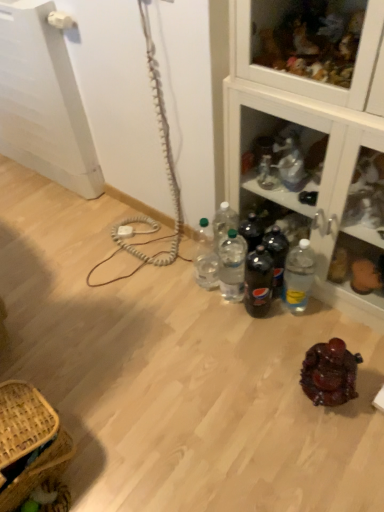
Question: Considering the relative sizes of dark glass bottle at center, the 3th bottle positioned from the right, and brown woven picnic basket at lower left in the image provided, is dark glass bottle at center, the 3th bottle positioned from the right, bigger than brown woven picnic basket at lower left?

Choices:
 (A) no
 (B) yes

Answer: (A)

Question: Is dark glass bottle at center, the 3th bottle positioned from the right, to the left of brown woven picnic basket at lower left from the viewer's perspective?

Choices:
 (A) yes
 (B) no

Answer: (B)

Question: Does dark glass bottle at center, the third bottle viewed from the left, have a lesser height compared to brown woven picnic basket at lower left?

Choices:
 (A) no
 (B) yes

Answer: (A)

Question: Is dark glass bottle at center, the third bottle viewed from the left, far from brown woven picnic basket at lower left?

Choices:
 (A) no
 (B) yes

Answer: (A)

Question: Is dark glass bottle at center, the third bottle viewed from the left, positioned beyond the bounds of brown woven picnic basket at lower left?

Choices:
 (A) yes
 (B) no

Answer: (A)

Question: In terms of height, does clear plastic bottles at center, the fifth bottle positioned from the right, look taller or shorter compared to clear plastic bottle at lower right, which is counted as the fifth bottle, starting from the left?

Choices:
 (A) tall
 (B) short

Answer: (A)

Question: Considering their positions, is clear plastic bottles at center, the fifth bottle positioned from the right, located in front of or behind clear plastic bottle at lower right, which is counted as the fifth bottle, starting from the left?

Choices:
 (A) behind
 (B) front

Answer: (A)

Question: From a real-world perspective, relative to clear plastic bottle at lower right, which appears as the 1th bottle when viewed from the right, is clear plastic bottles at center, the first bottle in the left-to-right sequence, vertically above or below?

Choices:
 (A) above
 (B) below

Answer: (A)

Question: Does point (203, 274) appear closer or farther from the camera than point (309, 278)?

Choices:
 (A) closer
 (B) farther

Answer: (B)

Question: In terms of size, does dark glass bottle at center, the third bottle viewed from the left, appear bigger or smaller than clear plastic bottles at center, the first bottle in the left-to-right sequence?

Choices:
 (A) big
 (B) small

Answer: (B)

Question: From a real-world perspective, relative to clear plastic bottles at center, the first bottle in the left-to-right sequence, is dark glass bottle at center, the 3th bottle positioned from the right, vertically above or below?

Choices:
 (A) below
 (B) above

Answer: (A)

Question: Is dark glass bottle at center, the 3th bottle positioned from the right, taller or shorter than clear plastic bottles at center, the first bottle in the left-to-right sequence?

Choices:
 (A) tall
 (B) short

Answer: (B)

Question: From the image's perspective, is dark glass bottle at center, the third bottle viewed from the left, above or below clear plastic bottles at center, the fifth bottle positioned from the right?

Choices:
 (A) below
 (B) above

Answer: (A)

Question: Is clear plastic bottle at lower right, which is counted as the fifth bottle, starting from the left, bigger or smaller than brown woven picnic basket at lower left?

Choices:
 (A) small
 (B) big

Answer: (A)

Question: Is clear plastic bottle at lower right, which is counted as the fifth bottle, starting from the left, spatially inside brown woven picnic basket at lower left, or outside of it?

Choices:
 (A) outside
 (B) inside

Answer: (A)